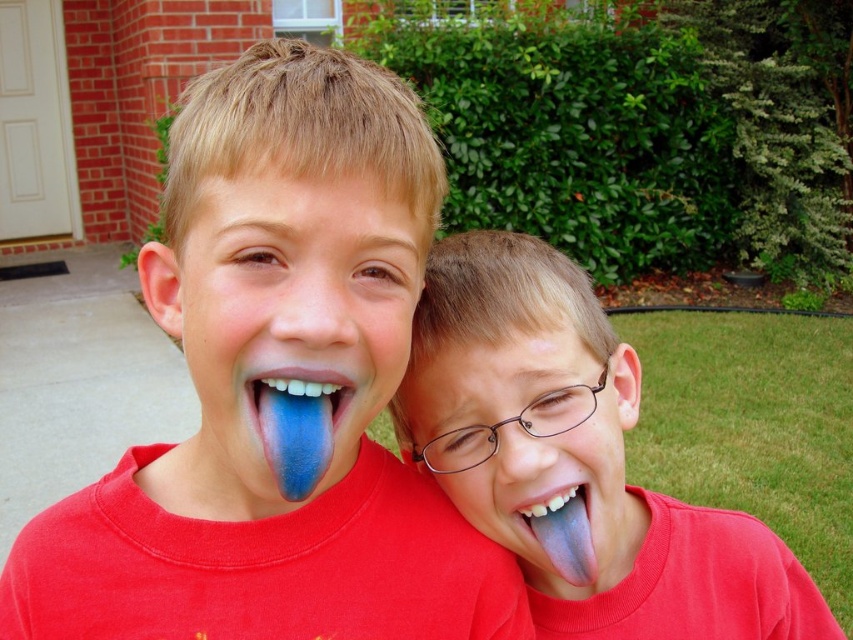
Which of these two, blue rubber tongue at center or blue matte tongue at center, stands shorter?

Standing shorter between the two is blue matte tongue at center.

Who is positioned more to the left, blue rubber tongue at center or blue matte tongue at center?

blue matte tongue at center

Where is `blue rubber tongue at center`? blue rubber tongue at center is located at coordinates (537, 451).

Which is in front, point (612, 467) or point (283, 413)?

Point (283, 413) is in front.

Who is lower down, blue rubber tongue at right or blue matte tongue at center?

blue rubber tongue at right is below.

Is point (596, 387) in front of point (338, 385)?

That is False.

At what (x,y) coordinates should I click in order to perform the action: click on blue rubber tongue at right. Please return your answer as a coordinate pair (x, y). Looking at the image, I should click on [x=573, y=460].

Can you confirm if blue glossy tongue at center is positioned to the left of blue rubber tongue at right?

Yes, blue glossy tongue at center is to the left of blue rubber tongue at right.

Measure the distance between point [352,381] and camera.

They are 20.58 inches apart.

Is point (149, 625) positioned in front of point (463, 259)?

Yes, point (149, 625) is closer to viewer.

I want to click on blue glossy tongue at center, so click(x=277, y=390).